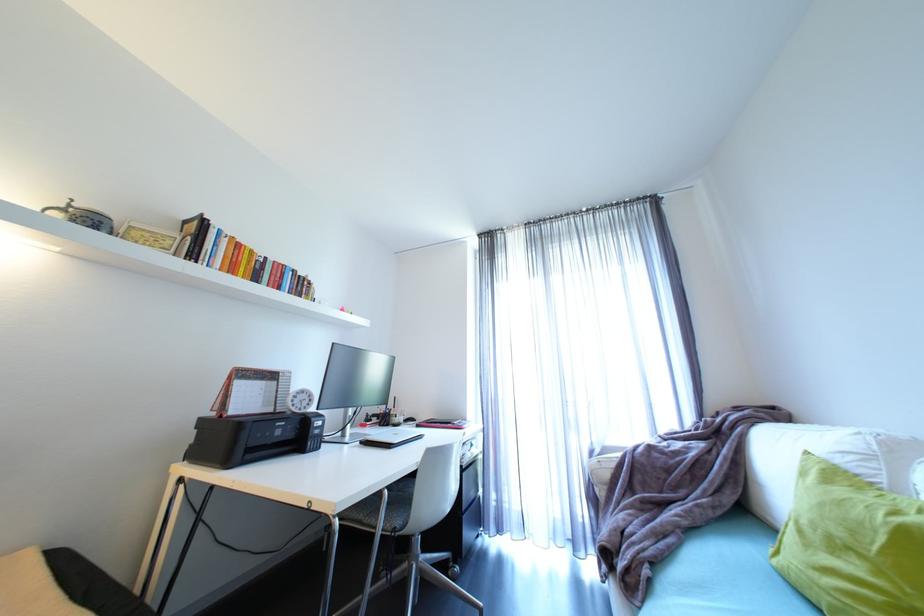
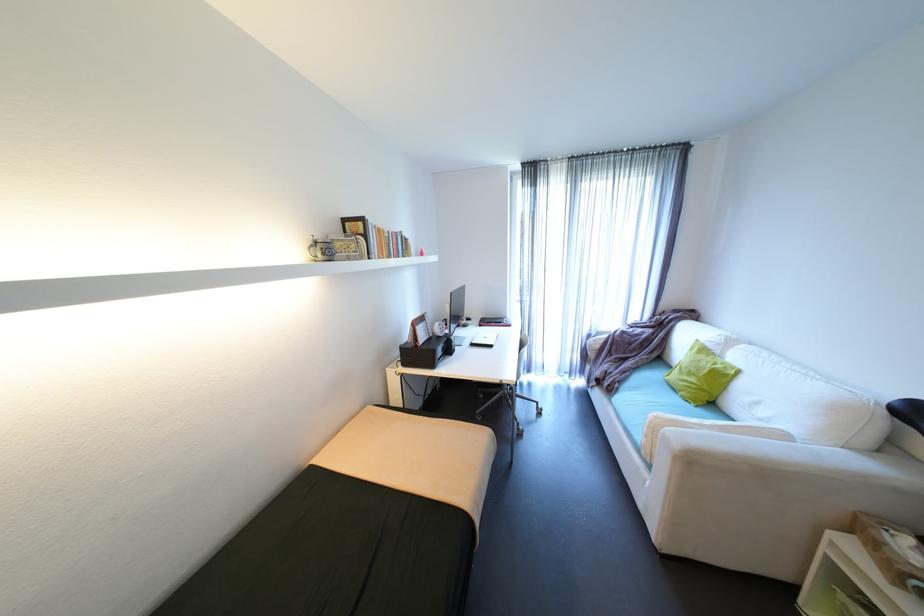
Find the pixel in the second image that matches pixel 208 262 in the first image.

(380, 254)